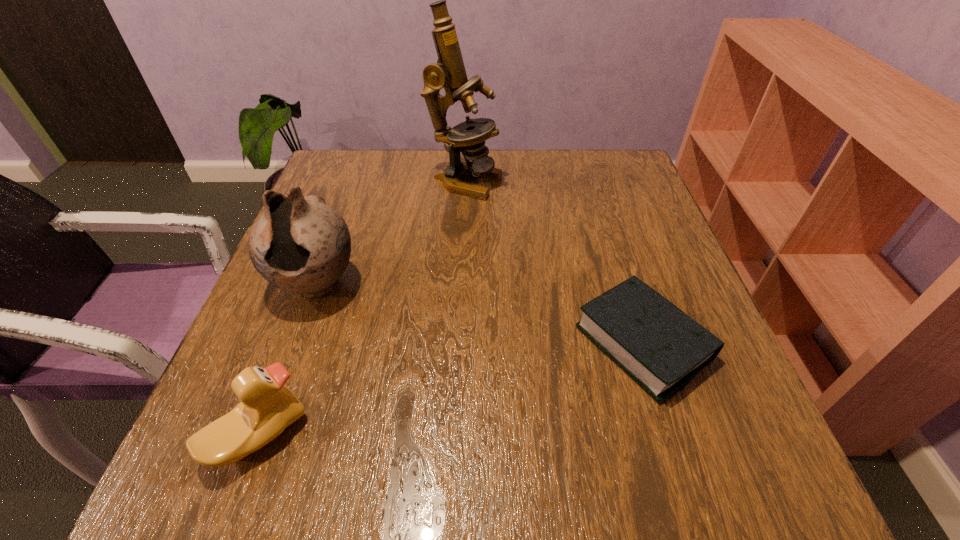
Find the location of `vacant point located between the pottery and the farthest object`. vacant point located between the pottery and the farthest object is located at coordinates (391, 233).

This screenshot has width=960, height=540. What are the coordinates of `vacant area between the duck and the farthest object` in the screenshot? It's located at (362, 308).

Locate an element on the screen. The width and height of the screenshot is (960, 540). free space between the tallest object and the duck is located at coordinates 362,308.

Identify which object is located as the second nearest to the tallest object. Please provide its 2D coordinates. Your answer should be formatted as a tuple, i.e. [(x, y)], where the tuple contains the x and y coordinates of a point satisfying the conditions above.

[(658, 345)]

At what (x,y) coordinates should I click in order to perform the action: click on object that can be found as the closest to the pottery. Please return your answer as a coordinate pair (x, y). This screenshot has width=960, height=540. Looking at the image, I should click on (267, 407).

Locate an element on the screen. This screenshot has height=540, width=960. free space that satisfies the following two spatial constraints: 1. from the spout of the second tallest object; 2. at the beak of the duck is located at coordinates click(261, 435).

Locate an element on the screen. vacant space that satisfies the following two spatial constraints: 1. on the front side of the third object from left to right; 2. on the right side of the shortest object is located at coordinates point(457,343).